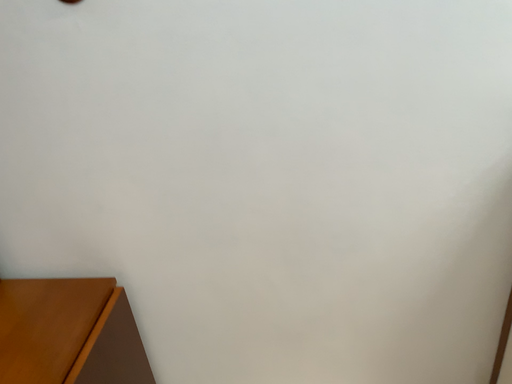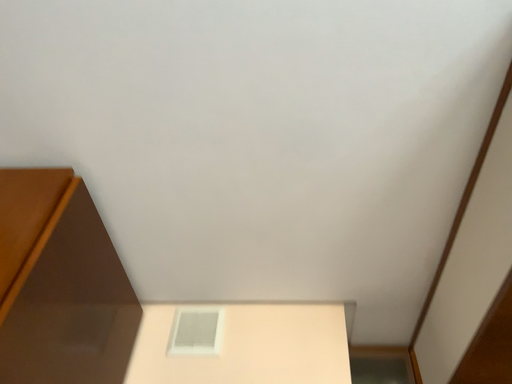
Question: Which way did the camera rotate in the video?

Choices:
 (A) rotated downward
 (B) rotated upward

Answer: (A)